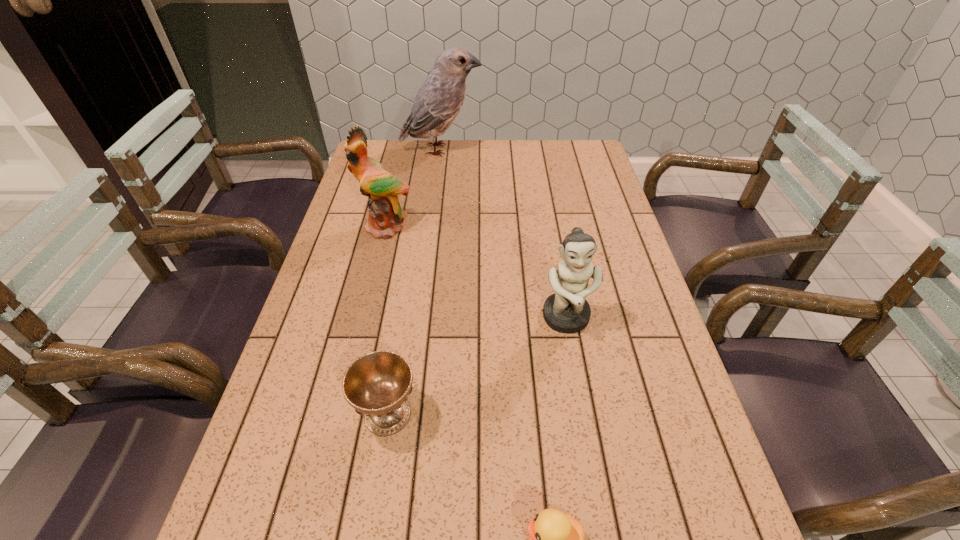
I want to click on object situated at the far edge, so click(439, 100).

Image resolution: width=960 pixels, height=540 pixels. I want to click on object situated at the right edge, so [567, 311].

Find the location of a particular element. This screenshot has height=540, width=960. object that is positioned at the far left corner is located at coordinates (439, 100).

What are the coordinates of `vacant space at the far edge of the desktop` in the screenshot? It's located at (498, 147).

Locate an element on the screen. free space at the left edge of the desktop is located at coordinates (320, 463).

Where is `vacant space at the right edge`? This screenshot has height=540, width=960. vacant space at the right edge is located at coordinates tap(663, 510).

Locate an element on the screen. free space at the far right corner of the desktop is located at coordinates (562, 167).

Locate an element on the screen. The height and width of the screenshot is (540, 960). unoccupied area between the nearer parrot and the figurine is located at coordinates (476, 273).

Locate an element on the screen. The height and width of the screenshot is (540, 960). free space between the third farthest object and the chalice is located at coordinates (477, 366).

I want to click on vacant space in between the second farthest object and the third farthest object, so click(x=476, y=273).